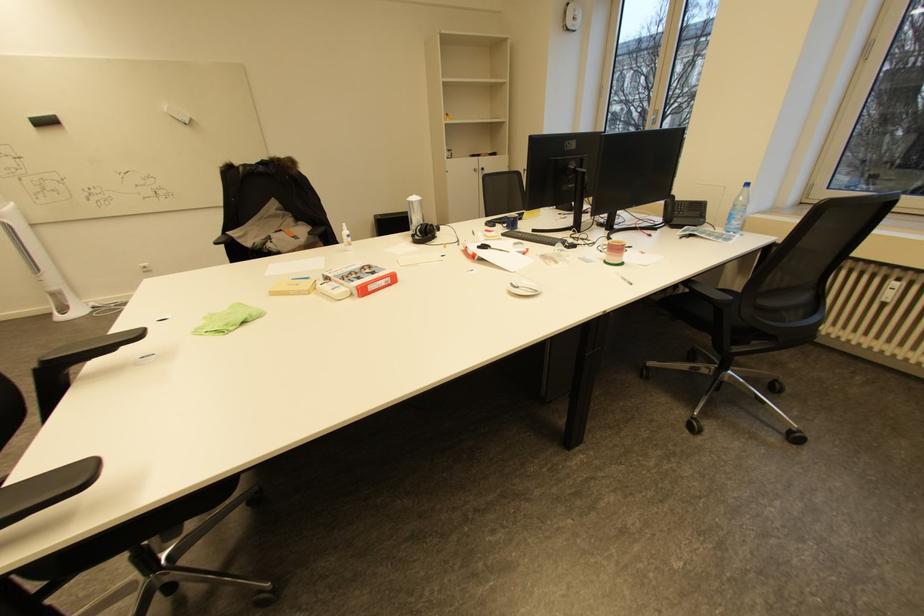
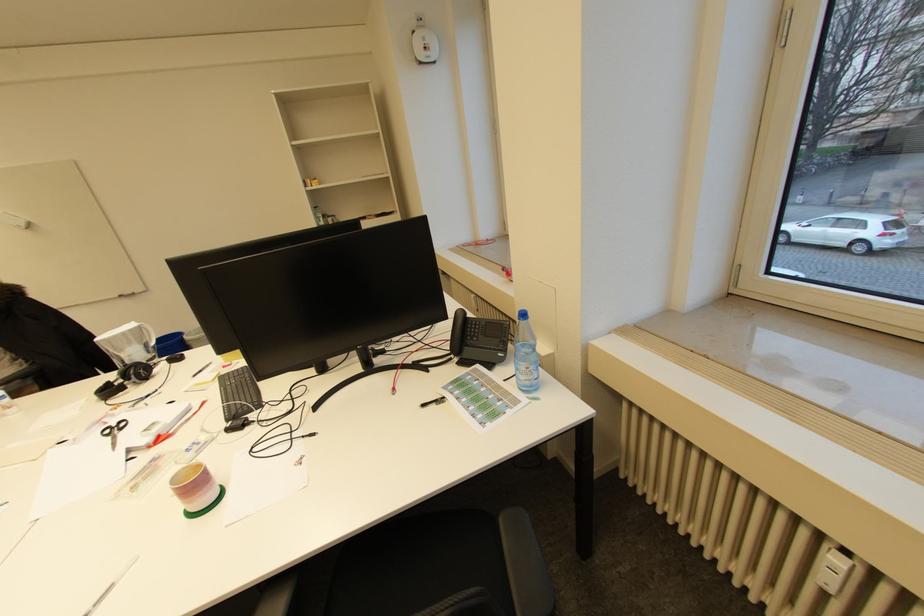
In the second image, find the point that corresponds to (895,296) in the first image.

(833, 580)